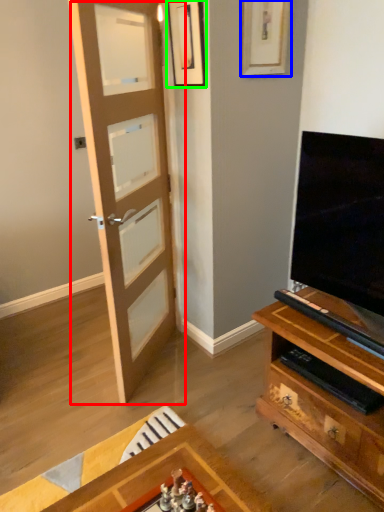
Question: Which object is the farthest from door (highlighted by a red box)? Choose among these: picture frame (highlighted by a blue box) or picture frame (highlighted by a green box).

Choices:
 (A) picture frame
 (B) picture frame

Answer: (A)